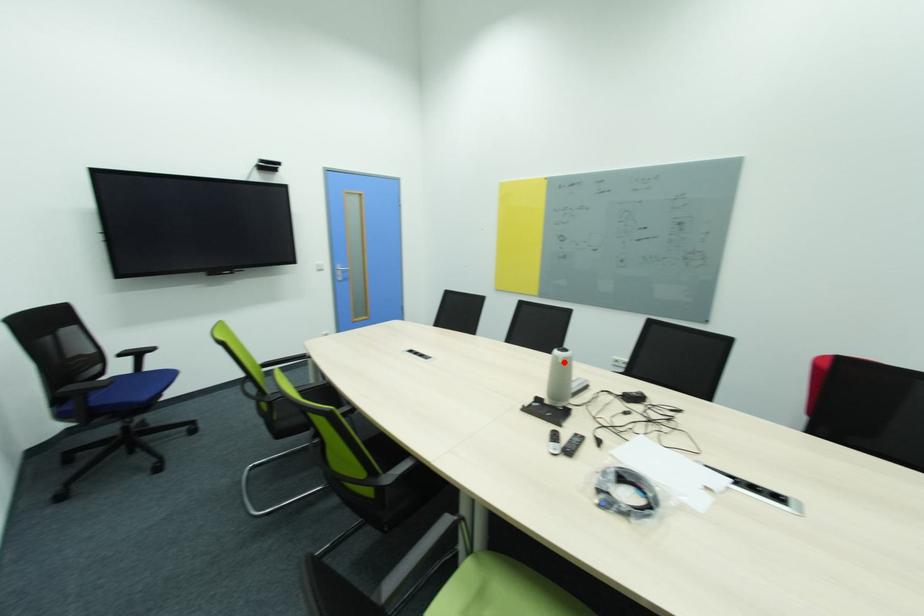
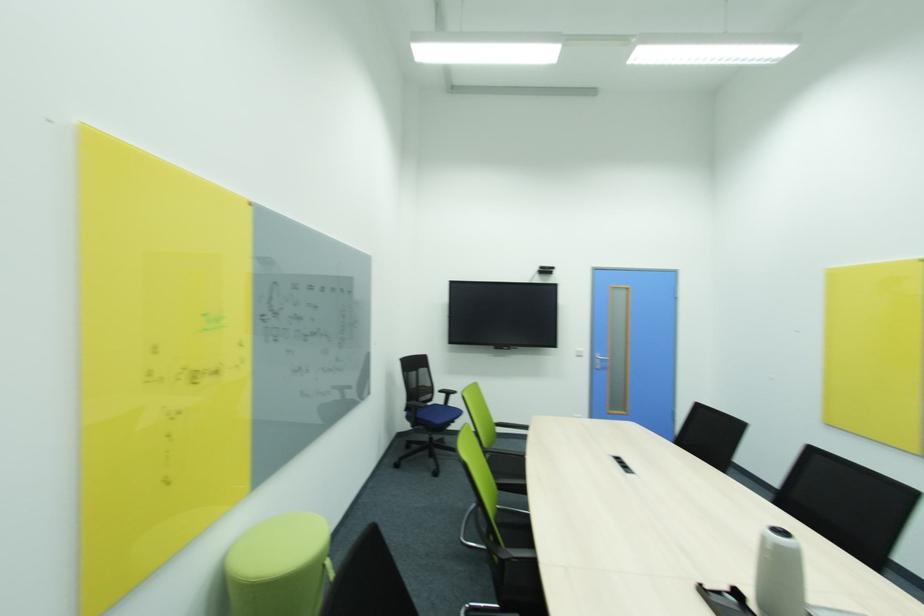
Locate, in the second image, the point that corresponds to the highlighted location in the first image.

(774, 548)